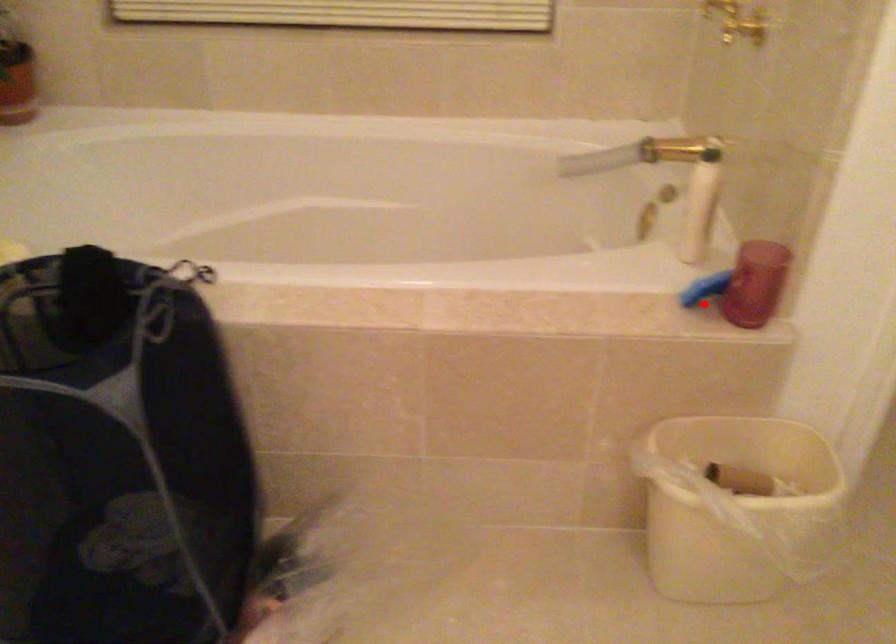
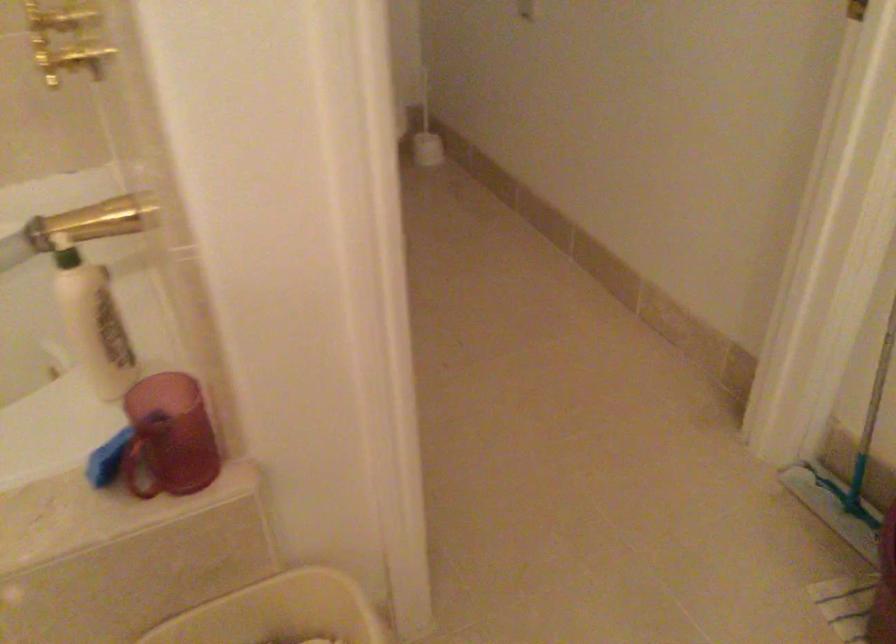
Question: I am providing you with two images of the same scene from different viewpoints. A red point is marked on the first image. Is the red point's position out of view in image 2?

Choices:
 (A) Yes
 (B) No

Answer: (B)